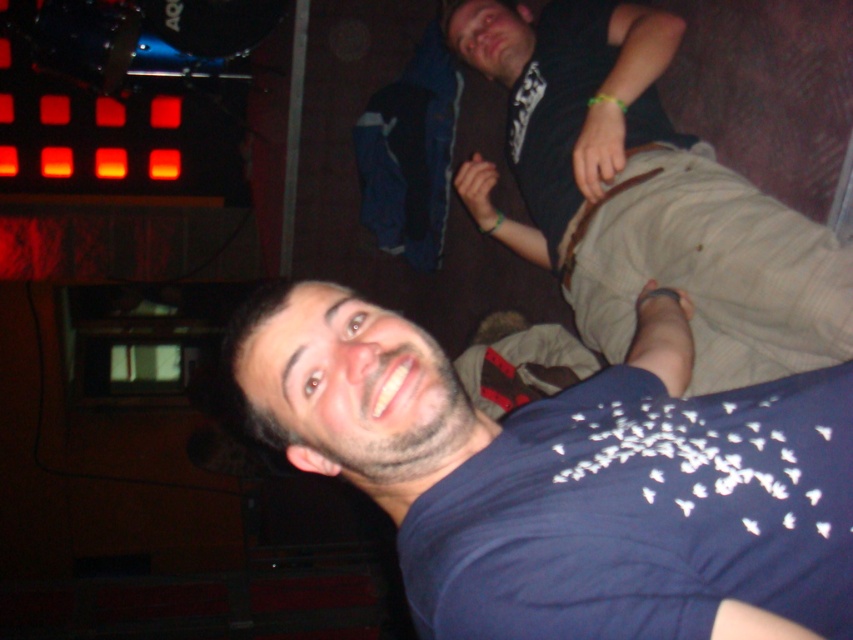
Question: Is dark blue t-shirt at center above khaki cotton pants at center?

Choices:
 (A) yes
 (B) no

Answer: (B)

Question: Which of the following is the closest to the observer?

Choices:
 (A) khaki cotton pants at center
 (B) dark blue t-shirt at center

Answer: (B)

Question: Can you confirm if dark blue t-shirt at center is positioned above khaki cotton pants at center?

Choices:
 (A) yes
 (B) no

Answer: (B)

Question: Which object is farther from the camera taking this photo?

Choices:
 (A) khaki cotton pants at center
 (B) dark blue t-shirt at center

Answer: (A)

Question: Among these objects, which one is farthest from the camera?

Choices:
 (A) dark blue t-shirt at center
 (B) khaki cotton pants at center

Answer: (B)

Question: Does dark blue t-shirt at center come behind khaki cotton pants at center?

Choices:
 (A) no
 (B) yes

Answer: (A)